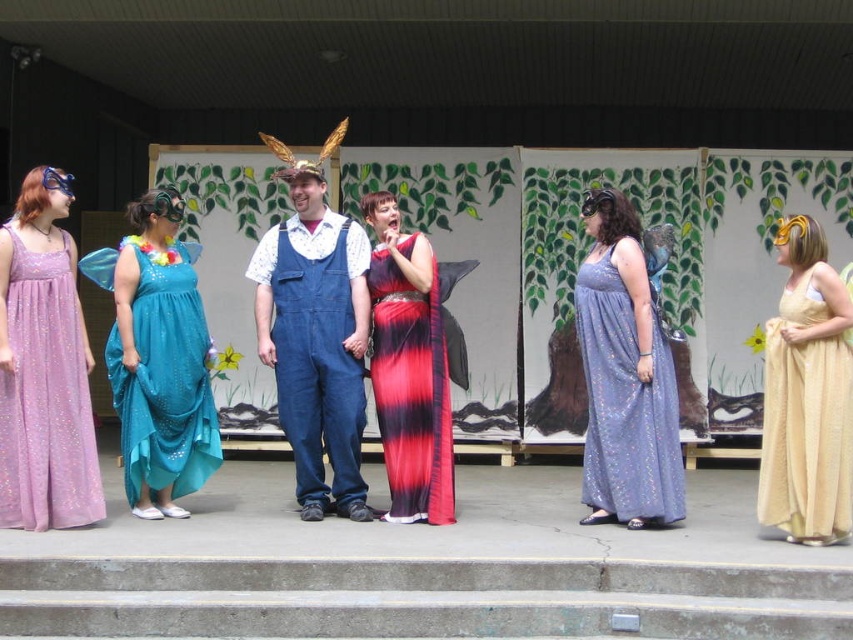
Question: Which point is closer to the camera?

Choices:
 (A) [680, 472]
 (B) [795, 378]
 (C) [198, 563]
 (D) [396, 396]

Answer: (C)

Question: Based on their relative distances, which object is farther from the shiny satin dress at center?

Choices:
 (A) sparkly purple dress at center
 (B) concrete stairs at lower center

Answer: (B)

Question: Does gold textured fabric dress at right have a smaller size compared to shiny satin dress at center?

Choices:
 (A) no
 (B) yes

Answer: (B)

Question: Does denim overalls at center appear over teal sequined dress at left?

Choices:
 (A) no
 (B) yes

Answer: (B)

Question: Which point is farther from the camera taking this photo?

Choices:
 (A) (590, 380)
 (B) (167, 289)
 (C) (842, 321)

Answer: (B)

Question: In this image, where is teal sequined dress at left located relative to shiny satin dress at center?

Choices:
 (A) above
 (B) below

Answer: (B)